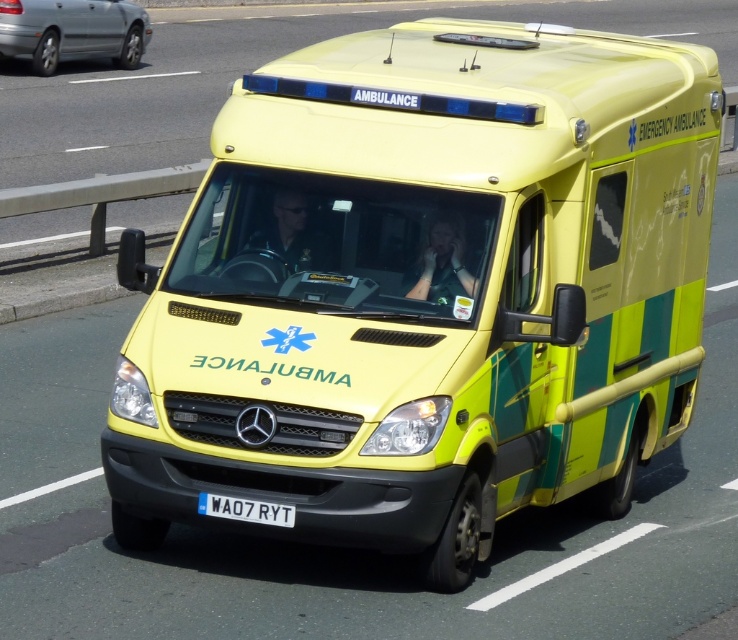
Is yellow matte ambulance at center below white plastic license plate at center?

No, yellow matte ambulance at center is not below white plastic license plate at center.

In the scene shown: Does yellow matte ambulance at center come behind white plastic license plate at center?

Yes.

You are a GUI agent. You are given a task and a screenshot of the screen. Output one action in this format:
    pyautogui.click(x=<x>, y=<y>)
    Task: Click on the yellow matte ambulance at center
    This screenshot has width=738, height=640.
    Given the screenshot: What is the action you would take?
    pyautogui.click(x=244, y=72)

Find the location of a particular element. The image size is (738, 640). yellow matte ambulance at center is located at coordinates (244, 72).

Can you confirm if silver metallic sedan at upper left is positioned to the right of white plastic license plate at center?

In fact, silver metallic sedan at upper left is to the left of white plastic license plate at center.

Can you confirm if silver metallic sedan at upper left is positioned below white plastic license plate at center?

No.

Looking at this image, who is more forward, [137,60] or [237,516]?

Point [237,516]

In order to click on silver metallic sedan at upper left in this screenshot , I will do `click(72, 29)`.

Does yellow matte ambulance at center appear on the right side of silver metallic sedan at upper left?

Indeed, yellow matte ambulance at center is positioned on the right side of silver metallic sedan at upper left.

Is point (106, 109) farther from camera compared to point (139, 56)?

No, (106, 109) is closer to viewer.

Is point (89, 145) farther from camera compared to point (7, 33)?

No, (89, 145) is in front of (7, 33).

Identify the location of yellow matte ambulance at center. This screenshot has height=640, width=738. (244, 72).